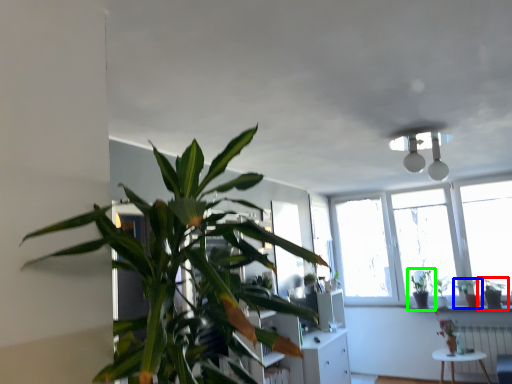
Question: Which object is positioned closest to houseplant (highlighted by a red box)? Select from houseplant (highlighted by a blue box) and houseplant (highlighted by a green box).

Choices:
 (A) houseplant
 (B) houseplant

Answer: (A)